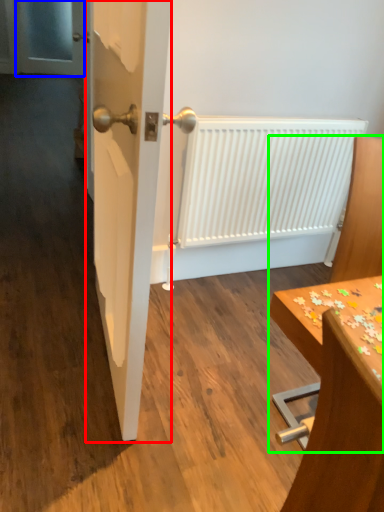
Question: Considering the real-world distances, which object is farthest from door (highlighted by a red box)? screen door (highlighted by a blue box) or furniture (highlighted by a green box)?

Choices:
 (A) screen door
 (B) furniture

Answer: (A)